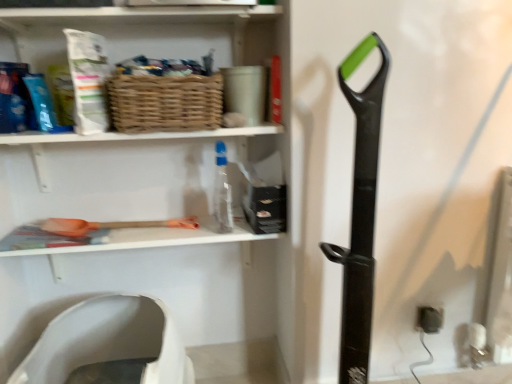
Question: From a real-world perspective, is transparent plastic bottle at center positioned above or below white plastic toilet seat at lower left?

Choices:
 (A) below
 (B) above

Answer: (B)

Question: Does point [231, 226] appear closer or farther from the camera than point [136, 332]?

Choices:
 (A) closer
 (B) farther

Answer: (A)

Question: Which is farther from the woven brown basket at upper center?

Choices:
 (A) transparent plastic bottle at center
 (B) white matte shelf at upper center, the 2th shelf when ordered from top to bottom
 (C) black plastic electric outlet at lower right
 (D) white plastic toilet seat at lower left
 (E) matte wicker basket at upper center, arranged as the 1th shelf when viewed from the top

Answer: (C)

Question: Based on their relative distances, which object is farther from the matte wicker basket at upper center, arranged as the 1th shelf when viewed from the top?

Choices:
 (A) black plastic electric outlet at lower right
 (B) white matte shelf at upper center, the 2th shelf when ordered from top to bottom
 (C) woven brown basket at upper center
 (D) transparent plastic bottle at center
 (E) white plastic toilet seat at lower left

Answer: (A)